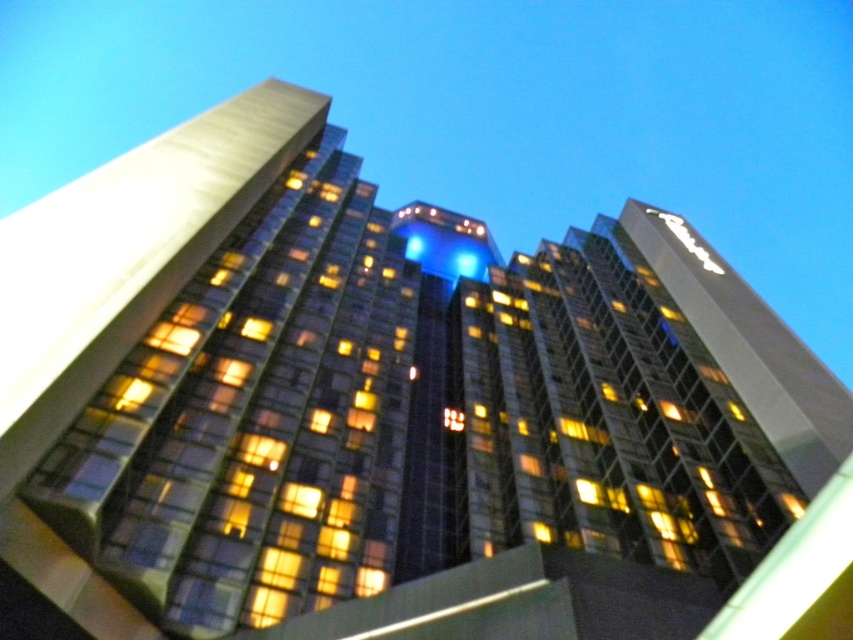
You are standing in front of the modern building at dusk. You notice two points marked on the building facade. The first point is at coordinates point (x=131, y=349) and the second is at point (x=717, y=272). Which point is closer to you?

Point (x=131, y=349) is in front of point (x=717, y=272), so it is closer to you.

You are standing in front of the glassy reflective building at center and want to see the white glossy sign at upper right. Is the sign visible through the building?

The glassy reflective building at center is in front of the white glossy sign at upper right, so the building may block the view of the sign depending on the angle and reflectiveness of the glass.